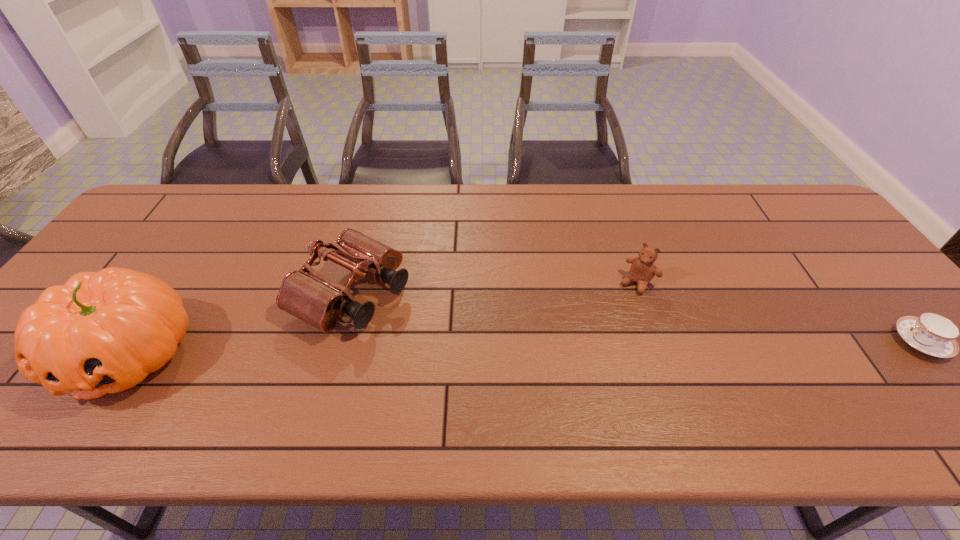
You are a GUI agent. You are given a task and a screenshot of the screen. Output one action in this format:
    pyautogui.click(x=<x>, y=<y>)
    Task: Click on the blank space located through the eyepieces of the third object from right to left
    
    Given the screenshot: What is the action you would take?
    pyautogui.click(x=530, y=389)

Locate an element on the screen. This screenshot has width=960, height=540. vacant space located 0.370m through the eyepieces of the third object from right to left is located at coordinates (530, 389).

At what (x,y) coordinates should I click in order to perform the action: click on object present at the near edge. Please return your answer as a coordinate pair (x, y). The width and height of the screenshot is (960, 540). Looking at the image, I should click on (102, 332).

The image size is (960, 540). In order to click on object positioned at the left edge in this screenshot , I will do `click(102, 332)`.

This screenshot has height=540, width=960. Identify the location of object at the near left corner. (102, 332).

Identify the location of free point at the far edge. This screenshot has width=960, height=540. (554, 199).

Identify the location of free region at the near edge. tap(692, 379).

Where is `free spot at the right edge of the desktop`? Image resolution: width=960 pixels, height=540 pixels. free spot at the right edge of the desktop is located at coordinates (869, 290).

Identify the location of free spot at the far left corner of the desktop. pyautogui.click(x=151, y=208).

Identify the location of vacant area between the teddy bear and the pumpkin. The image size is (960, 540). pyautogui.click(x=383, y=318).